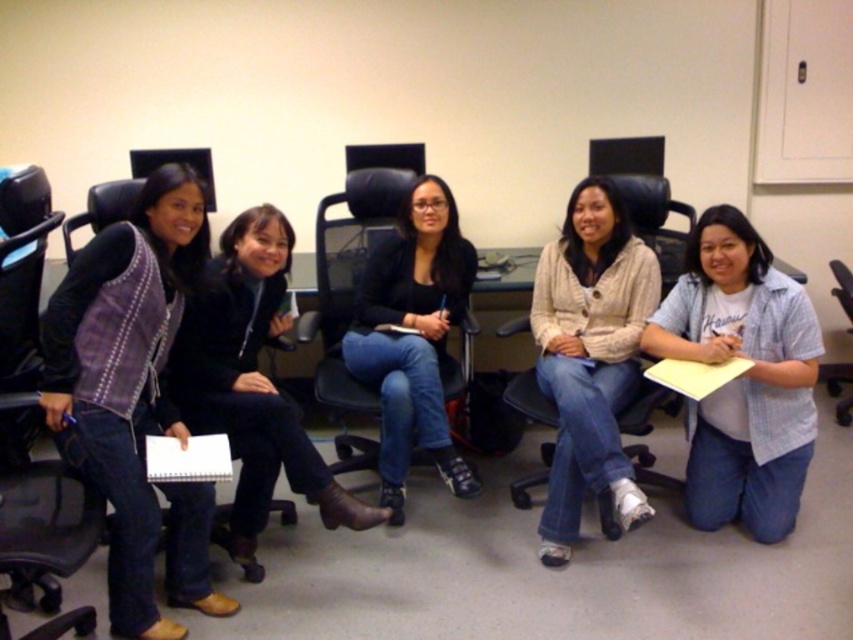
You are sitting in the black plastic swivel chair at lower right and want to hand a document to the person wearing the light beige sweater at center. In which direction should you move to reach them?

The light beige sweater at center is to the left of the black plastic swivel chair at lower right, so you should move to your left to reach them.